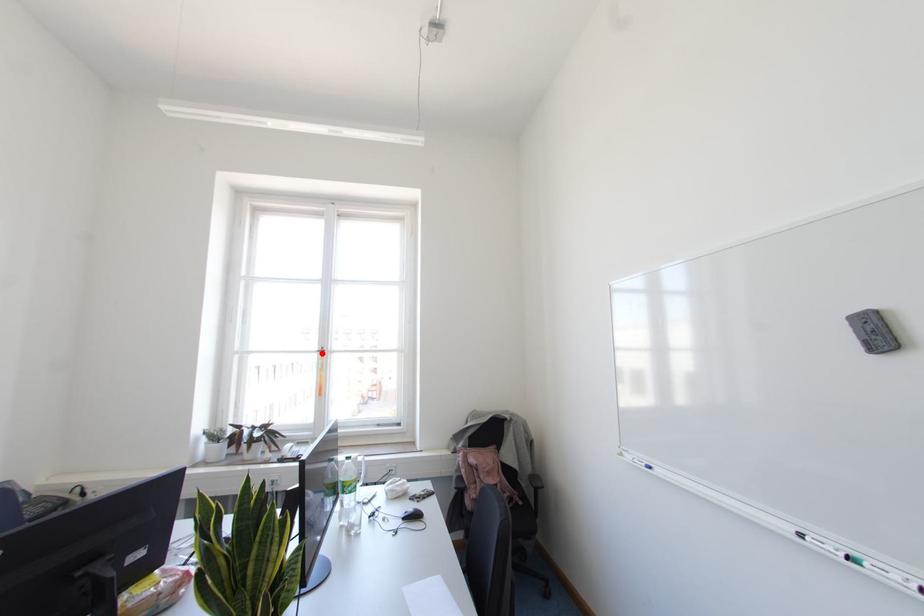
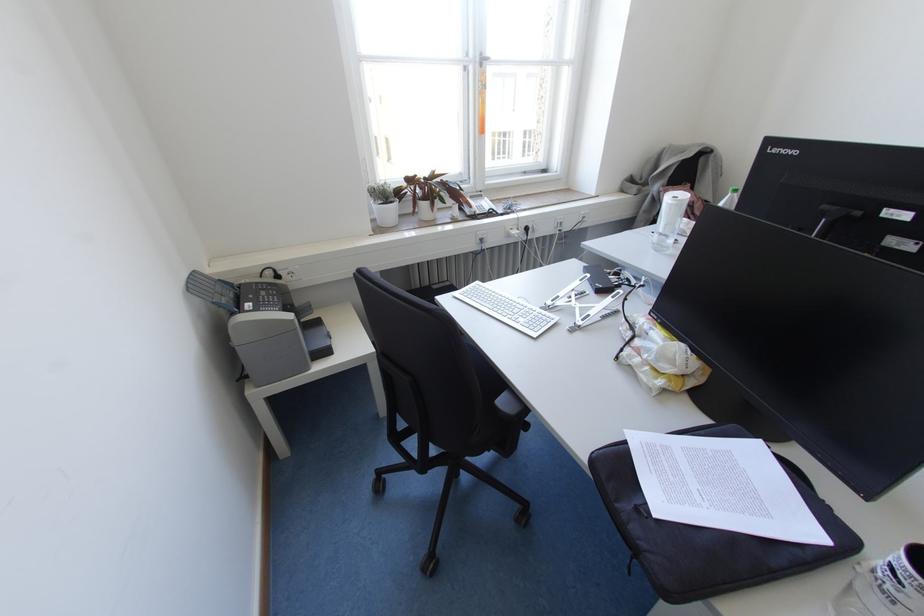
Where in the second image is the point corresponding to the highlighted location from the first image?

(480, 65)